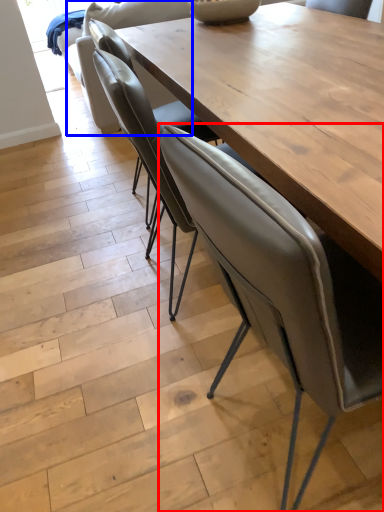
Question: Which object appears farthest to the camera in this image, chair (highlighted by a red box) or armchair (highlighted by a blue box)?

Choices:
 (A) chair
 (B) armchair

Answer: (B)